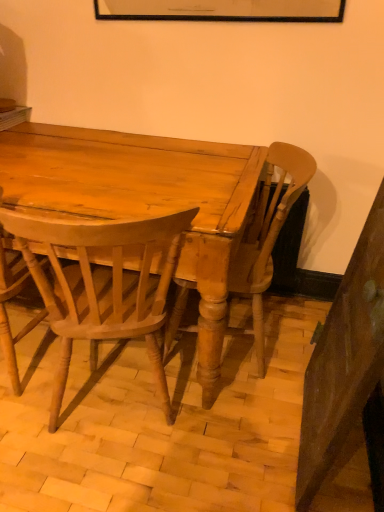
Question: Can you confirm if light brown wood chair at center, placed as the 1th chair when sorted from right to left, is shorter than light brown wood chair at center, acting as the 2th chair starting from the left?

Choices:
 (A) yes
 (B) no

Answer: (B)

Question: From a real-world perspective, is light brown wood chair at center, marked as the third chair in a left-to-right arrangement, physically below light brown wood chair at center, the 2th chair from the right?

Choices:
 (A) yes
 (B) no

Answer: (B)

Question: Is light brown wood chair at center, placed as the 1th chair when sorted from right to left, behind light brown wood chair at center, acting as the 2th chair starting from the left?

Choices:
 (A) yes
 (B) no

Answer: (A)

Question: Does light brown wood chair at center, placed as the 1th chair when sorted from right to left, contain light brown wood chair at center, the 2th chair from the right?

Choices:
 (A) no
 (B) yes

Answer: (A)

Question: Is light brown wood chair at center, placed as the 1th chair when sorted from right to left, at the left side of light brown wood chair at center, the 2th chair from the right?

Choices:
 (A) no
 (B) yes

Answer: (A)

Question: From their relative heights in the image, would you say matte wood desk at center is taller or shorter than light brown wood chair at center, the 3th chair in the right-to-left sequence?

Choices:
 (A) short
 (B) tall

Answer: (A)

Question: Considering the positions of matte wood desk at center and light brown wood chair at center, which ranks as the 1th chair in left-to-right order, in the image, is matte wood desk at center wider or thinner than light brown wood chair at center, which ranks as the 1th chair in left-to-right order,?

Choices:
 (A) wide
 (B) thin

Answer: (A)

Question: Considering their positions, is matte wood desk at center located in front of or behind light brown wood chair at center, the 3th chair in the right-to-left sequence?

Choices:
 (A) front
 (B) behind

Answer: (B)

Question: Looking at the image, does matte wood desk at center seem bigger or smaller compared to light brown wood chair at center, the 3th chair in the right-to-left sequence?

Choices:
 (A) big
 (B) small

Answer: (A)

Question: From their relative heights in the image, would you say matte wood desk at center is taller or shorter than light brown wood chair at center, marked as the third chair in a left-to-right arrangement?

Choices:
 (A) short
 (B) tall

Answer: (A)

Question: Does point (132, 163) appear closer or farther from the camera than point (251, 295)?

Choices:
 (A) farther
 (B) closer

Answer: (B)

Question: From a real-world perspective, relative to light brown wood chair at center, placed as the 1th chair when sorted from right to left, is matte wood desk at center vertically above or below?

Choices:
 (A) above
 (B) below

Answer: (B)

Question: Is matte wood desk at center to the left or to the right of light brown wood chair at center, marked as the third chair in a left-to-right arrangement, in the image?

Choices:
 (A) right
 (B) left

Answer: (B)

Question: Visually, is light brown wood chair at center, which ranks as the 1th chair in left-to-right order, positioned to the left or to the right of light brown wood chair at center, placed as the 1th chair when sorted from right to left?

Choices:
 (A) left
 (B) right

Answer: (A)

Question: From the image's perspective, is light brown wood chair at center, which ranks as the 1th chair in left-to-right order, positioned above or below light brown wood chair at center, placed as the 1th chair when sorted from right to left?

Choices:
 (A) above
 (B) below

Answer: (B)